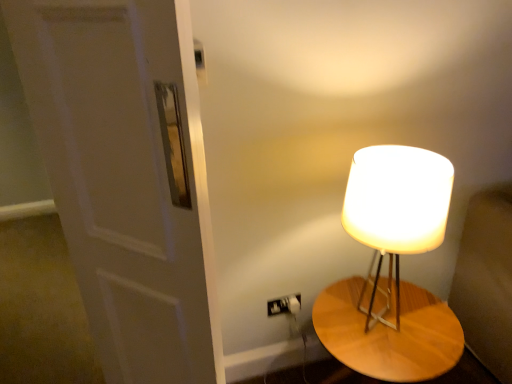
Question: Is matte white lampshade at right outside white matte door at left?

Choices:
 (A) yes
 (B) no

Answer: (A)

Question: Considering the relative sizes of matte white lampshade at right and white matte door at left in the image provided, is matte white lampshade at right bigger than white matte door at left?

Choices:
 (A) no
 (B) yes

Answer: (B)

Question: Does matte white lampshade at right have a lesser height compared to white matte door at left?

Choices:
 (A) yes
 (B) no

Answer: (A)

Question: Can you confirm if matte white lampshade at right is smaller than white matte door at left?

Choices:
 (A) no
 (B) yes

Answer: (A)

Question: Is the surface of matte white lampshade at right in direct contact with white matte door at left?

Choices:
 (A) no
 (B) yes

Answer: (A)

Question: From a real-world perspective, is matte white lampshade at right positioned over white matte door at left based on gravity?

Choices:
 (A) yes
 (B) no

Answer: (B)

Question: Is wooden table at right to the left of matte white lampshade at right from the viewer's perspective?

Choices:
 (A) no
 (B) yes

Answer: (A)

Question: Does wooden table at right lie in front of matte white lampshade at right?

Choices:
 (A) no
 (B) yes

Answer: (A)

Question: Can you confirm if wooden table at right is bigger than matte white lampshade at right?

Choices:
 (A) yes
 (B) no

Answer: (A)

Question: From a real-world perspective, is wooden table at right positioned over matte white lampshade at right based on gravity?

Choices:
 (A) no
 (B) yes

Answer: (A)

Question: Considering the relative sizes of wooden table at right and matte white lampshade at right in the image provided, is wooden table at right wider than matte white lampshade at right?

Choices:
 (A) yes
 (B) no

Answer: (A)

Question: From the image's perspective, does wooden table at right appear higher than matte white lampshade at right?

Choices:
 (A) yes
 (B) no

Answer: (B)

Question: Would you say matte white lampshade at right is outside wooden table at right?

Choices:
 (A) no
 (B) yes

Answer: (B)